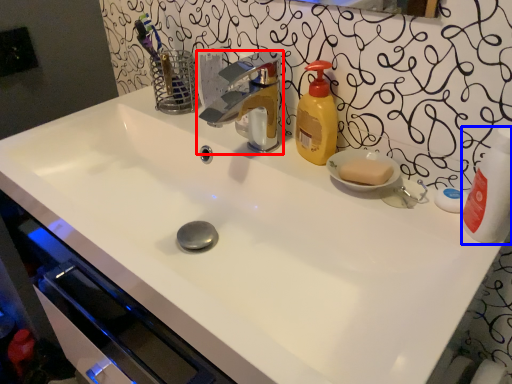
Question: Which object is closer to the camera taking this photo, tap (highlighted by a red box) or cleaning product (highlighted by a blue box)?

Choices:
 (A) tap
 (B) cleaning product

Answer: (B)